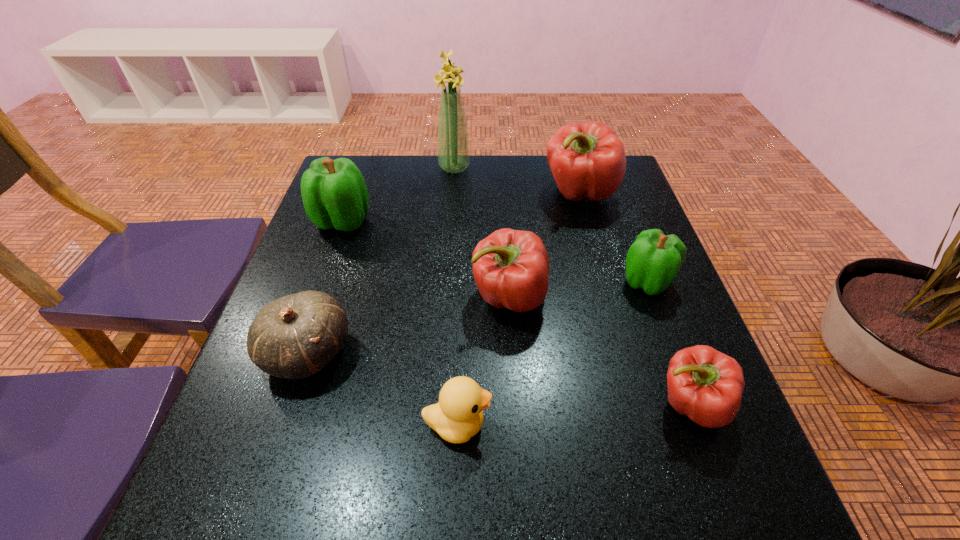
Image resolution: width=960 pixels, height=540 pixels. I want to click on vacant space located 0.250m on the face of the duck, so tap(638, 424).

I want to click on bouquet that is positioned at the far edge, so click(453, 148).

Locate an element on the screen. bell pepper that is at the far edge is located at coordinates (587, 160).

Locate an element on the screen. bell pepper that is at the left edge is located at coordinates (334, 193).

The image size is (960, 540). I want to click on gourd situated at the left edge, so click(x=294, y=337).

Identify the location of object at the far right corner. Image resolution: width=960 pixels, height=540 pixels. (587, 160).

Where is `vacant space at the far edge`? The height and width of the screenshot is (540, 960). vacant space at the far edge is located at coordinates (552, 187).

Locate an element on the screen. vacant space at the near edge of the desktop is located at coordinates (535, 527).

You are a GUI agent. You are given a task and a screenshot of the screen. Output one action in this format:
    pyautogui.click(x=<x>, y=<y>)
    Task: Click on the vacant space at the left edge of the desktop
    The width and height of the screenshot is (960, 540).
    Given the screenshot: What is the action you would take?
    (262, 383)

This screenshot has height=540, width=960. In the image, there is a desktop. What are the coordinates of `free space at the right edge` in the screenshot? It's located at (727, 451).